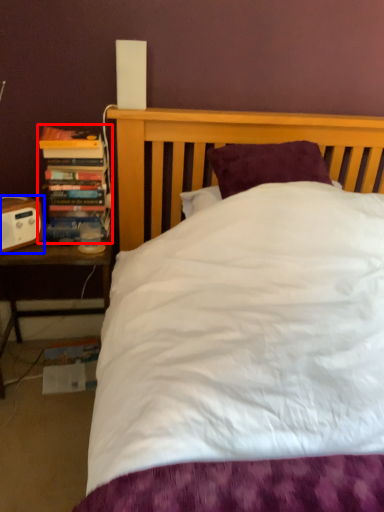
Question: Which of the following is the farthest to the observer, book (highlighted by a red box) or speaker (highlighted by a blue box)?

Choices:
 (A) book
 (B) speaker

Answer: (A)